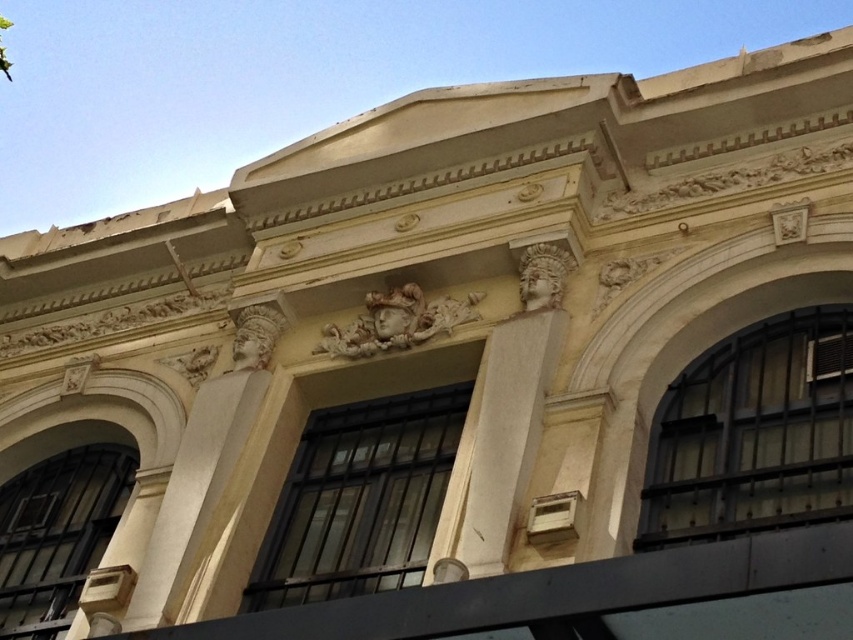
Is white stone column at center wider than white marble column at center?

Yes.

Is white stone column at center shorter than white marble column at center?

Incorrect, white stone column at center's height does not fall short of white marble column at center's.

At what (x,y) coordinates should I click in order to perform the action: click on white stone column at center. Please return your answer as a coordinate pair (x, y). The image size is (853, 640). Looking at the image, I should click on (500, 442).